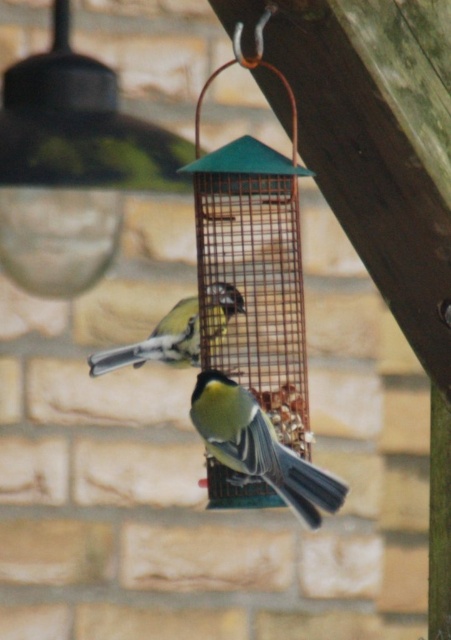
Does point (253, 179) lie in front of point (170, 339)?

That is True.

How much distance is there between green mesh bird feeder at center and yellow-green feathers at center?

green mesh bird feeder at center and yellow-green feathers at center are 7.18 inches apart.

Is point (208, 250) less distant than point (162, 317)?

Yes.

The image size is (451, 640). Find the location of `green mesh bird feeder at center`. green mesh bird feeder at center is located at coordinates (256, 273).

Which of these two, green matte bird at center or yellow-green feathers at center, stands shorter?

yellow-green feathers at center is shorter.

How distant is green matte bird at center from yellow-green feathers at center?

13.14 inches

Who is more forward, [215,436] or [119,348]?

Point [215,436] is more forward.

This screenshot has width=451, height=640. Find the location of `green matte bird at center`. green matte bird at center is located at coordinates (258, 448).

Between green mesh bird feeder at center and green matte bird at center, which one has more height?

Standing taller between the two is green mesh bird feeder at center.

Does point (262, 403) come farther from viewer compared to point (280, 460)?

Yes, it is.

Image resolution: width=451 pixels, height=640 pixels. I want to click on green mesh bird feeder at center, so click(256, 273).